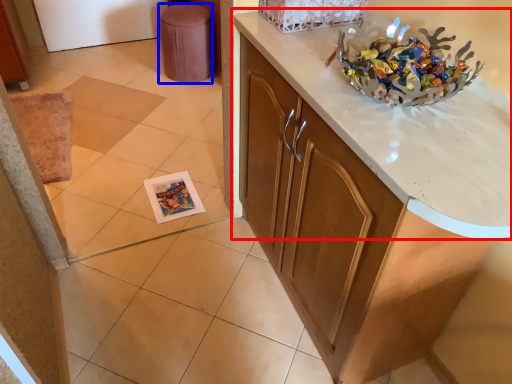
Question: Which object appears farthest to the camera in this image, countertop (highlighted by a red box) or stool (highlighted by a blue box)?

Choices:
 (A) countertop
 (B) stool

Answer: (B)